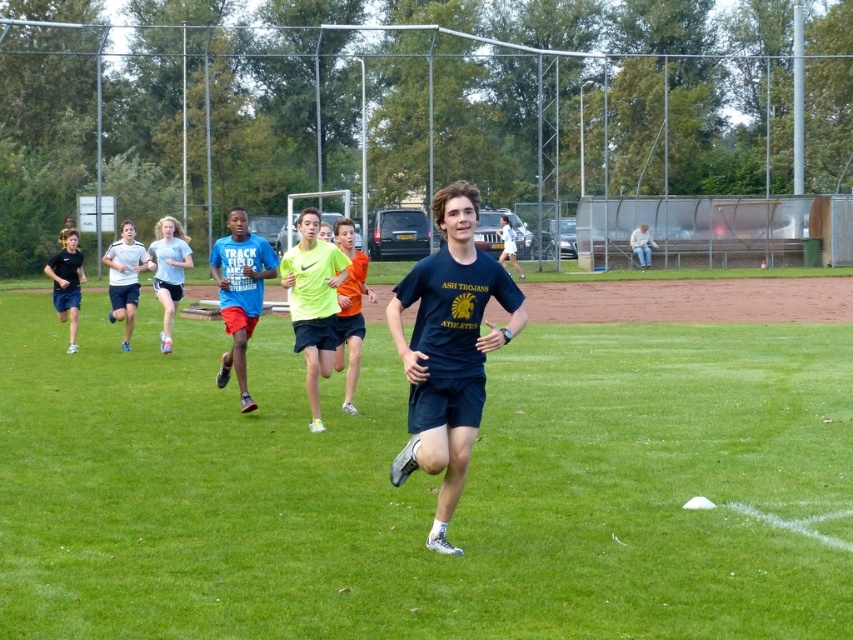
Question: In this image, where is light blue athletic shorts at left located relative to white fabric shirt at upper right?

Choices:
 (A) below
 (B) above

Answer: (A)

Question: Which of the following is the closest to the observer?

Choices:
 (A) neon yellow shirt at center
 (B) light blue jersey at center

Answer: (A)

Question: Which object is farther from the camera taking this photo?

Choices:
 (A) green grass at center
 (B) white matte shirt at center
 (C) light blue jersey at center

Answer: (B)

Question: Does green grass at center appear over white matte shirt at center?

Choices:
 (A) yes
 (B) no

Answer: (B)

Question: Which is farther from the white fabric shirt at upper right?

Choices:
 (A) green grass at center
 (B) light blue jersey at center
 (C) neon green athletic shorts at center

Answer: (C)

Question: Is green grass at center to the right of neon yellow shirt at center from the viewer's perspective?

Choices:
 (A) no
 (B) yes

Answer: (B)